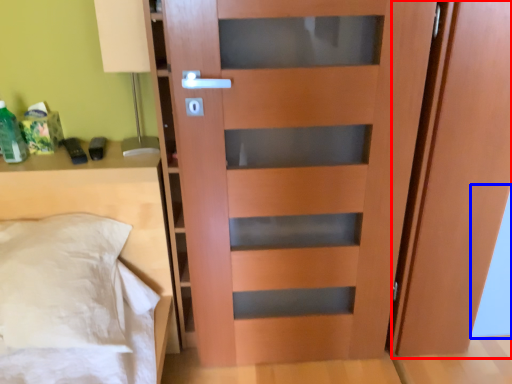
Question: Which point is further to the camera, screen door (highlighted by a red box) or glass door (highlighted by a blue box)?

Choices:
 (A) screen door
 (B) glass door

Answer: (B)